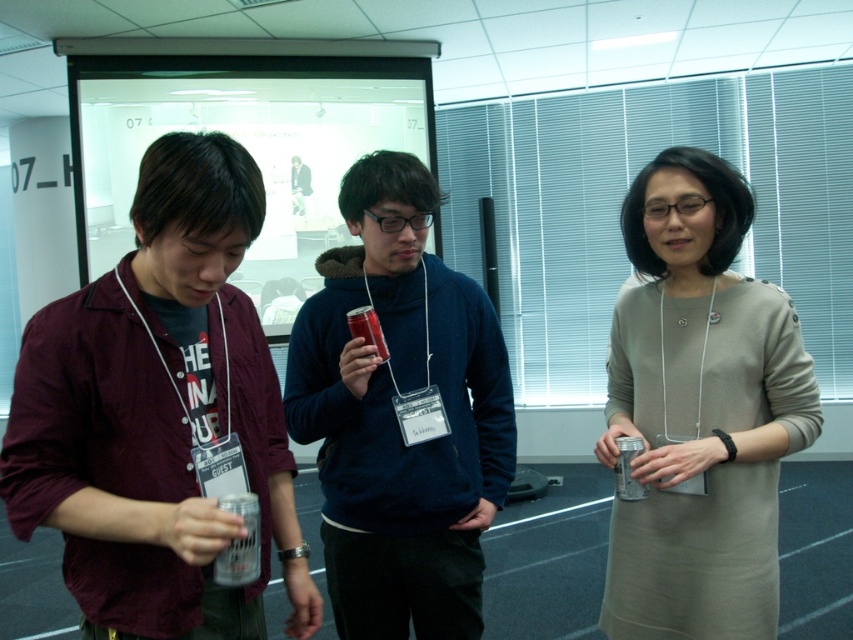
Question: Can you confirm if maroon shirt at left is positioned above matte gray dress at center?

Choices:
 (A) yes
 (B) no

Answer: (A)

Question: Which of the following is the farthest from the observer?

Choices:
 (A) matte blue hoodie at center
 (B) maroon shirt at left

Answer: (A)

Question: Which point is closer to the camera?

Choices:
 (A) matte blue hoodie at center
 (B) maroon shirt at left
 (C) matte gray dress at center

Answer: (B)

Question: Is maroon shirt at left to the left of matte blue hoodie at center from the viewer's perspective?

Choices:
 (A) yes
 (B) no

Answer: (A)

Question: Does maroon shirt at left appear under matte gray dress at center?

Choices:
 (A) yes
 (B) no

Answer: (B)

Question: Which of the following is the closest to the observer?

Choices:
 (A) matte gray dress at center
 (B) maroon shirt at left
 (C) matte blue hoodie at center

Answer: (B)